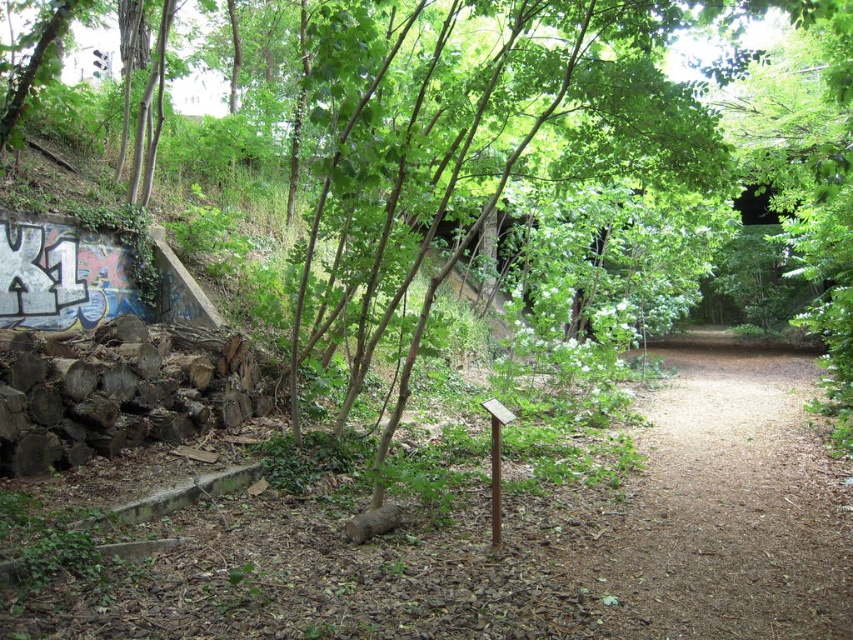
You are a hiker who wants to walk along the brown dirt path at center. However, you notice a green leafy tree at center above you. Do you think the tree might block your path?

The brown dirt path at center is below the green leafy tree at center, so the tree is positioned above the path. This means the tree might cast shade over the path but would not physically block your way unless its branches extend downward significantly. Since the description doesn

You are a hiker trying to decide which path to take. You see the brown dirt path at center and the green leafy tree at center. Which one is bigger in size?

The brown dirt path at center has a larger size compared to the green leafy tree at center, so the brown dirt path at center is bigger.